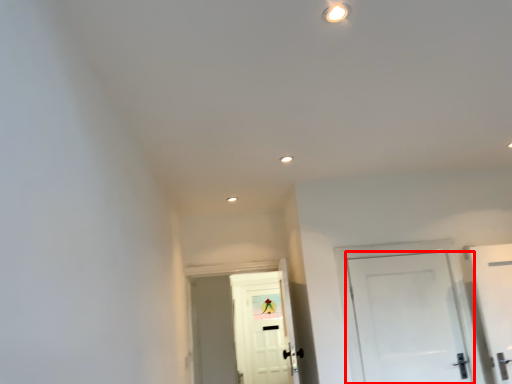
Question: Where is door (annotated by the red box) located in relation to door in the image?

Choices:
 (A) left
 (B) right

Answer: (B)